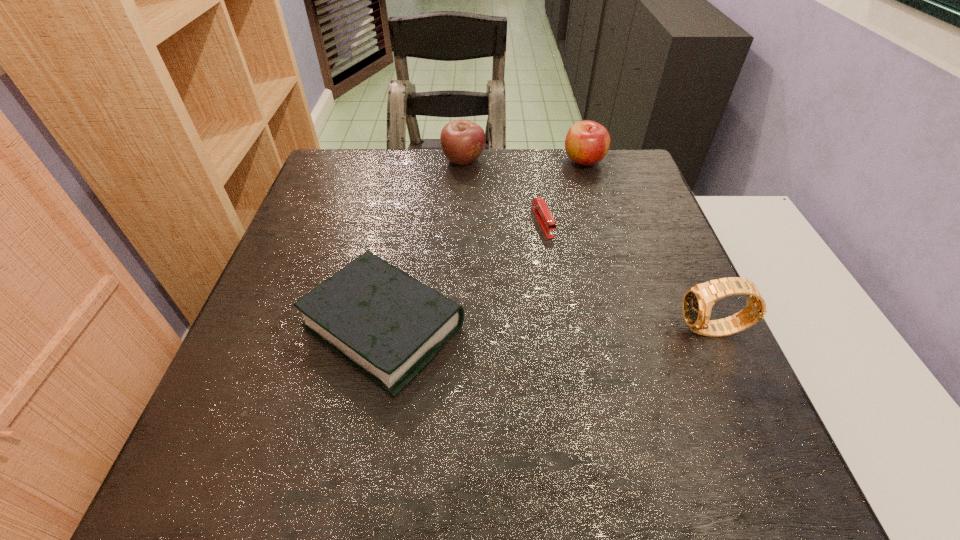
Where is `free space on the desktop that is between the Bible and the watch and is positioned on the side of the left apple with the unique marking`? free space on the desktop that is between the Bible and the watch and is positioned on the side of the left apple with the unique marking is located at coordinates (553, 329).

Locate an element on the screen. The height and width of the screenshot is (540, 960). vacant spot on the desktop that is between the Bible and the rightmost object and is positioned on the front-facing side of the shortest object is located at coordinates (596, 329).

Locate an element on the screen. The height and width of the screenshot is (540, 960). free space on the desktop that is between the second shortest object and the watch and is positioned on the stem of the right apple is located at coordinates (597, 329).